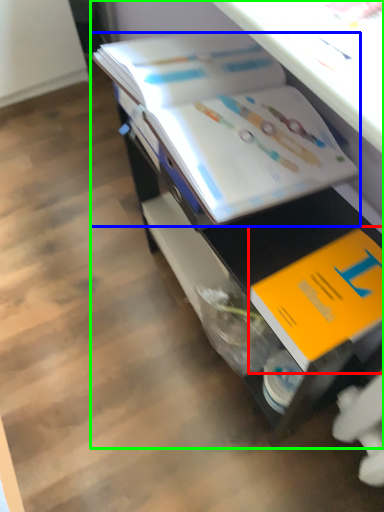
Question: Which is nearer to the book (highlighted by a red box)? book (highlighted by a blue box) or desk (highlighted by a green box).

Choices:
 (A) book
 (B) desk

Answer: (B)